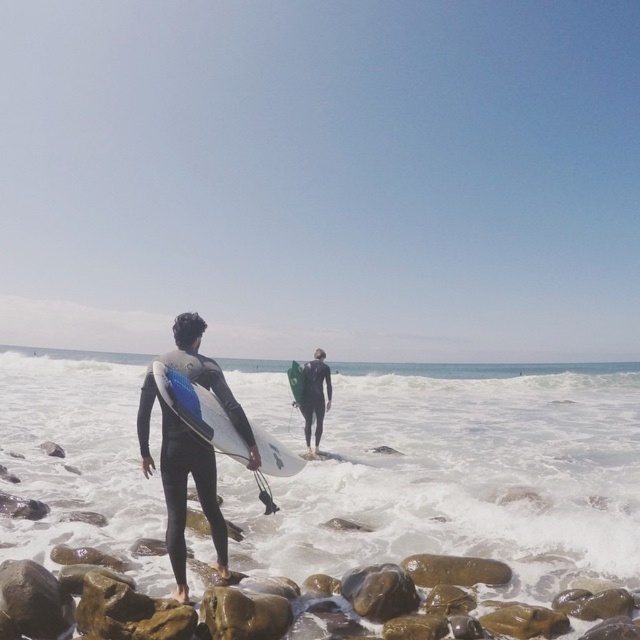
You are a photographer trying to capture the black matte wetsuit at center and the white foam water at lower center in the same frame. Based on their positions, which object should you adjust your camera to focus on first to ensure both are in the shot?

The white foam water at lower center is to the left of the black matte wetsuit at center, so you should focus on the black matte wetsuit at center first as it is closer to the camera and adjust the frame to include the white foam water at lower center to the left.

You are standing at the center of the beach and want to reach the white foam water at lower center. Which direction should you walk to reach it?

The white foam water at lower center is located at point [461,476], so you should walk towards the lower center direction to reach it.

From the picture: You are a photographer trying to capture the black wetsuit at center and the white foam water at lower center in the same frame. Based on their positions, which object is closer to the camera?

The black wetsuit at center is closer to the camera because the white foam water at lower center is positioned under it.